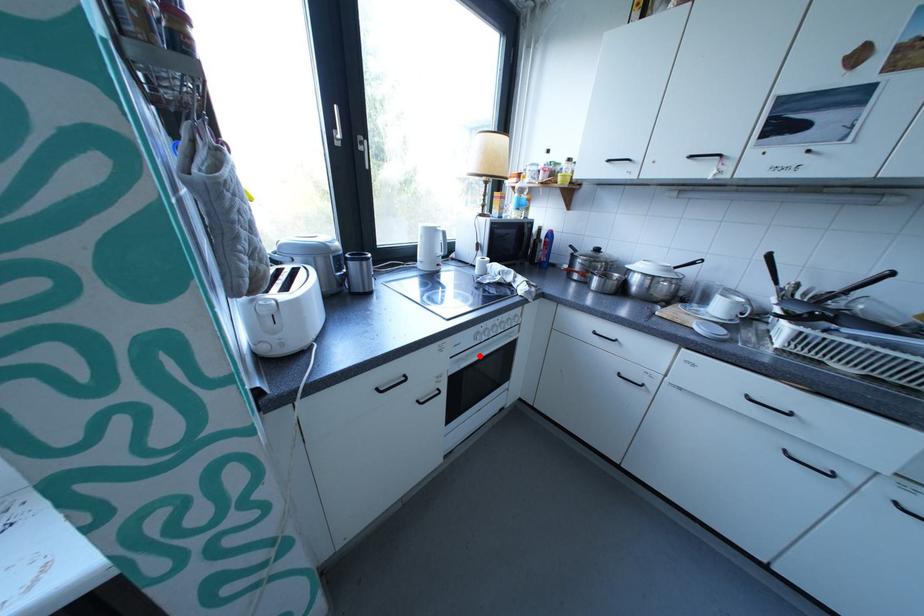
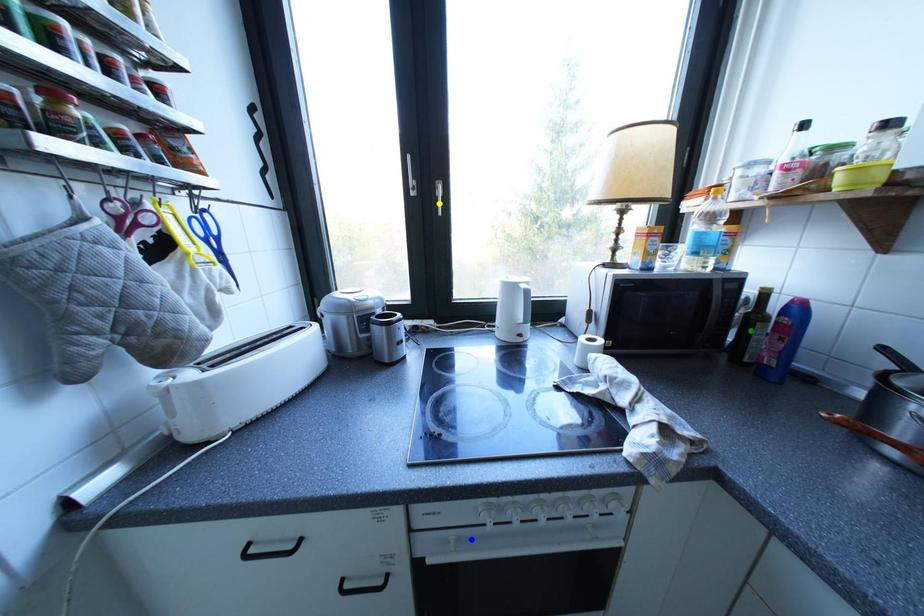
Question: I am providing you with two images of the same scene from different viewpoints. A red point is marked on the first image. You are given multiple points on the second image. Which point in image 2 is actually the same real-world point as the red point in image 1?

Choices:
 (A) yellow point
 (B) green point
 (C) blue point

Answer: (C)